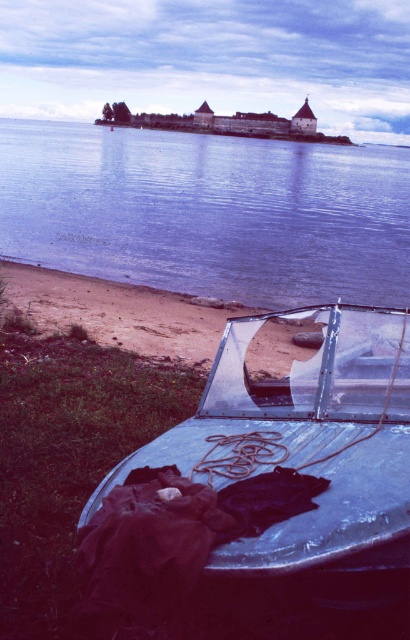
Does blue water at center have a lesser height compared to metallic blue boat at lower center?

No.

Between blue water at center and metallic blue boat at lower center, which one has more height?

Standing taller between the two is blue water at center.

Which is behind, point (380, 202) or point (129, 461)?

The point (380, 202) is more distant.

Where is `blue water at center`? Image resolution: width=410 pixels, height=640 pixels. blue water at center is located at coordinates (209, 212).